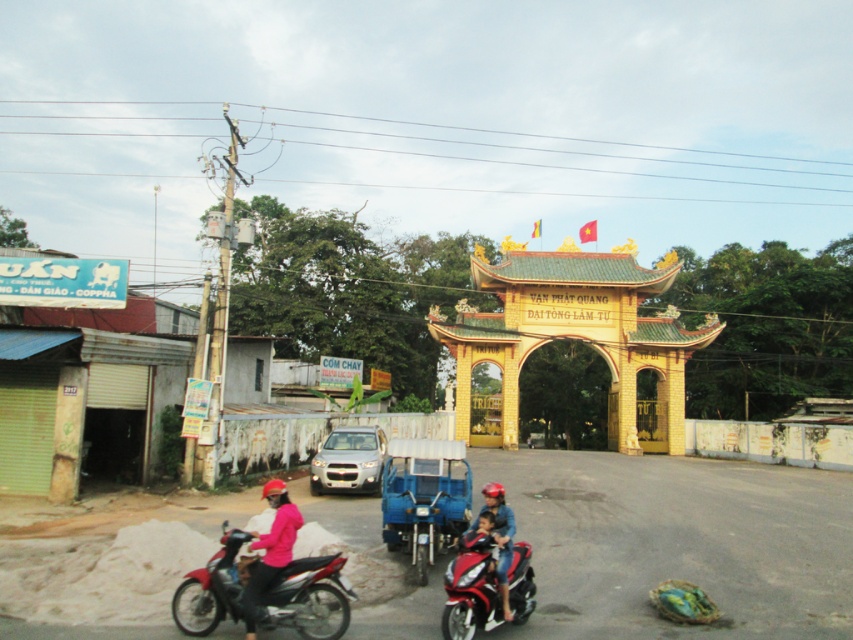
In the scene shown: You are a tourist visiting this town and want to park your shiny red motorcycle at lower left near the temple gate. However, there is already a matte pink helmet at center on the spot you want. Can you park your motorcycle there?

The shiny red motorcycle at lower left is located above the matte pink helmet at center, meaning the motorcycle is already parked in that spot. Therefore, you cannot park there again.

You are a tourist standing at the entrance of the temple and want to park your shiny red motorcycle at lower center. The parking area is located at point [469,588]. Can you safely park your motorcycle there?

The shiny red motorcycle at lower center is already parked at point [469,588], so you can safely park your motorcycle there.